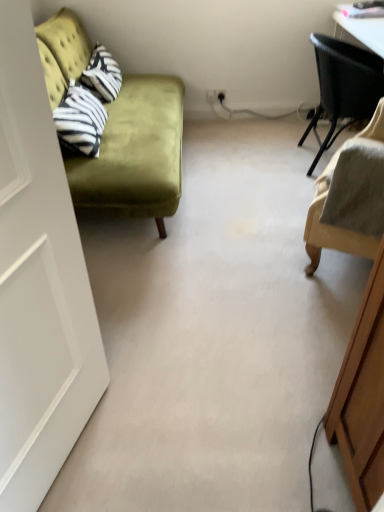
Question: From the image's perspective, is white matte door at left above or below velvet green couch at left?

Choices:
 (A) above
 (B) below

Answer: (B)

Question: Is white matte door at left inside or outside of velvet green couch at left?

Choices:
 (A) inside
 (B) outside

Answer: (B)

Question: Estimate the real-world distances between objects in this image. Which object is closer to the black woven chair at upper right, acting as the 2th chair starting from the front?

Choices:
 (A) white matte door at left
 (B) beige fabric chair at right, the first chair in the bottom-to-top sequence
 (C) velvet green couch at left

Answer: (B)

Question: Which of these objects is positioned farthest from the beige fabric chair at right, the second chair from the back?

Choices:
 (A) white matte door at left
 (B) velvet green couch at left
 (C) black woven chair at upper right, arranged as the second chair when ordered from the bottom

Answer: (A)